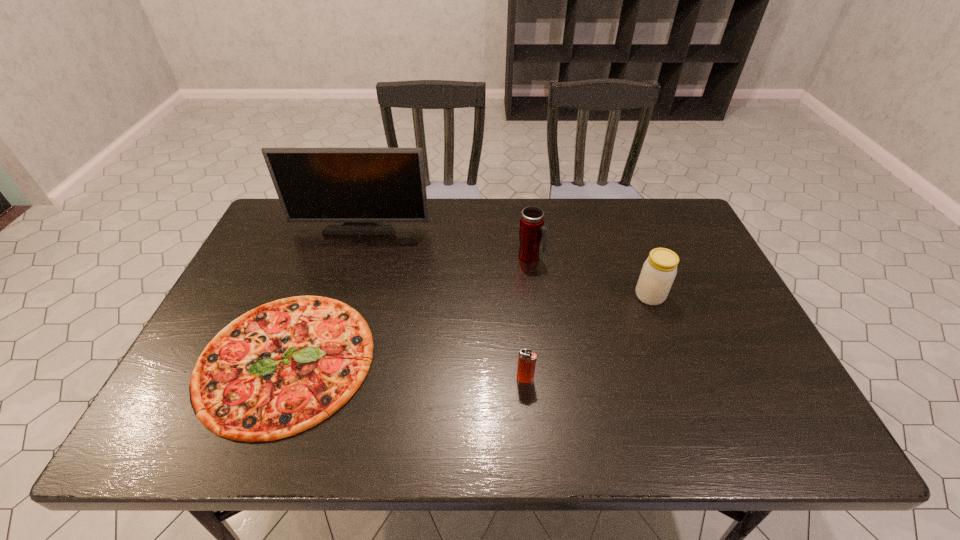
Identify the location of vacant point that satisfies the following two spatial constraints: 1. on the screen side of the jar; 2. on the left side of the monitor. (340, 296).